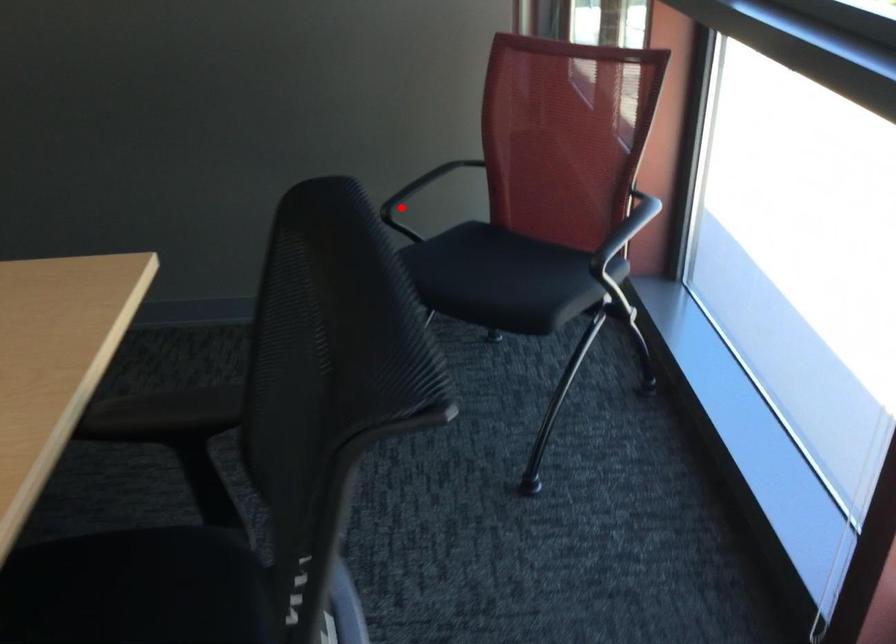
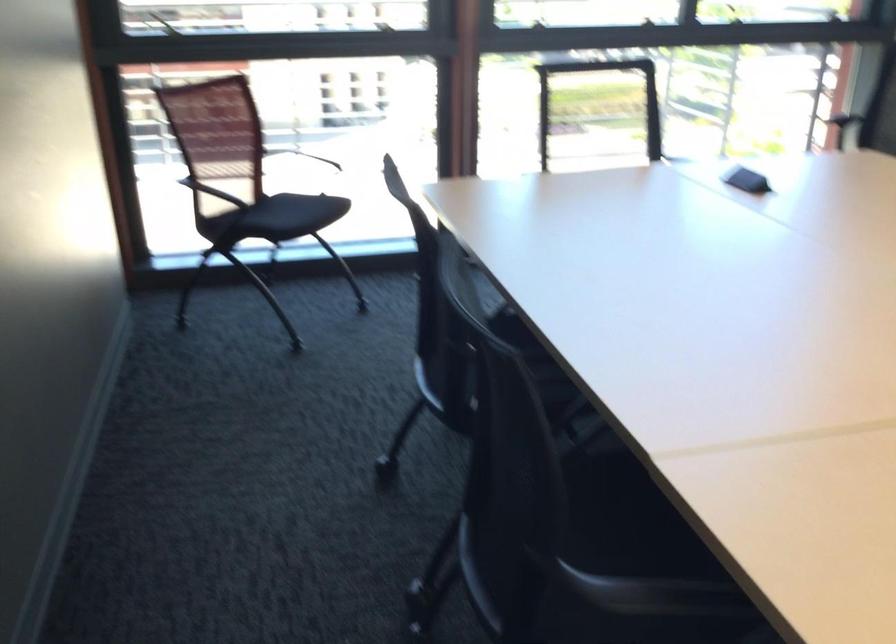
Question: I am providing you with two images of the same scene from different viewpoints. A red point is marked on the first image. Is the red point's position out of view in image 2?

Choices:
 (A) Yes
 (B) No

Answer: (A)